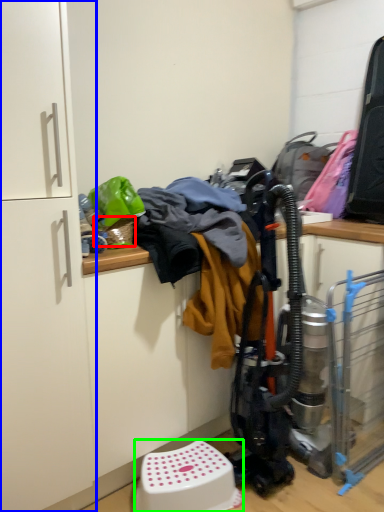
Question: Estimate the real-world distances between objects in this image. Which object is closer to basket (highlighted by a red box), cabinetry (highlighted by a blue box) or step stool (highlighted by a green box)?

Choices:
 (A) cabinetry
 (B) step stool

Answer: (A)